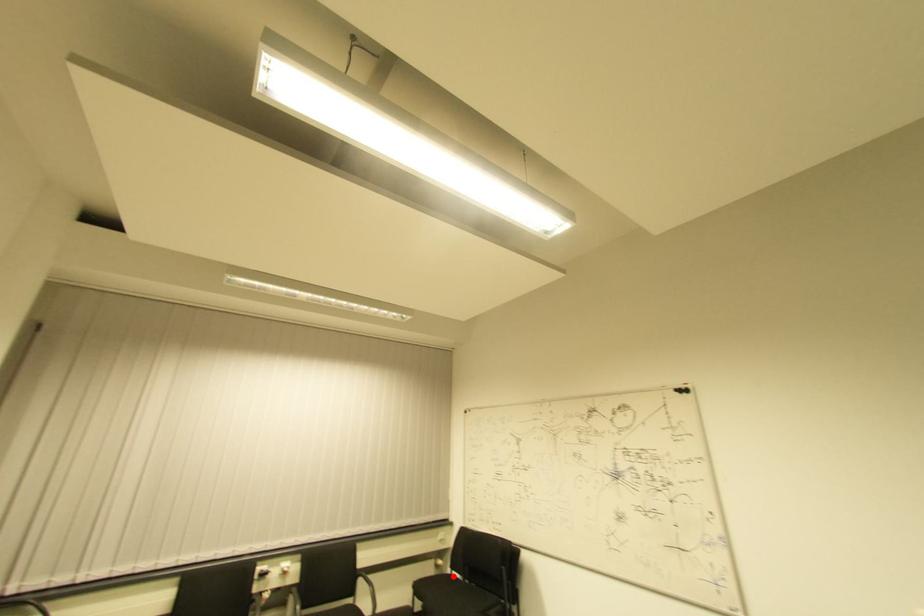
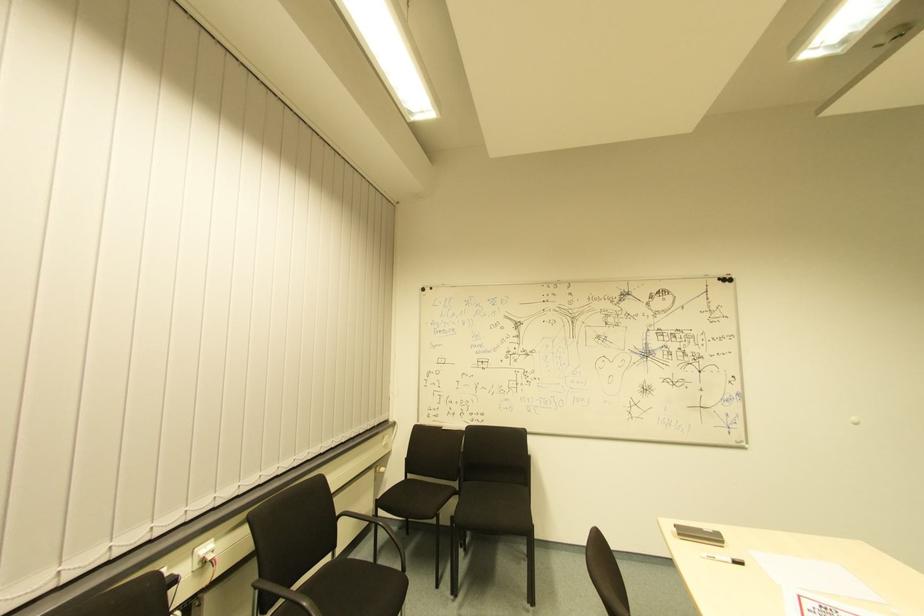
Question: I am providing you with two images of the same scene from different viewpoints. In image1, a red point is highlighted. Considering the same 3D point in image2, which of the following is correct?

Choices:
 (A) It is closer
 (B) It is farther

Answer: (B)